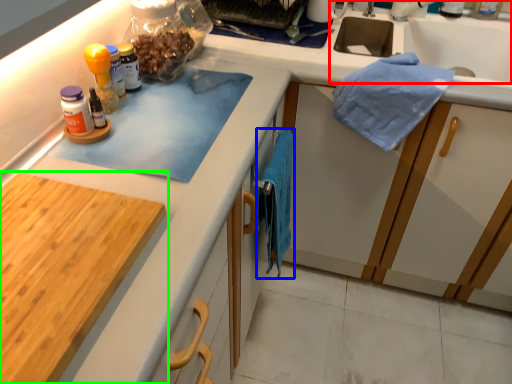
Question: Which object is the closest to the sink (highlighted by a red box)? Choose among these: bath towel (highlighted by a blue box) or cabinetry (highlighted by a green box).

Choices:
 (A) bath towel
 (B) cabinetry

Answer: (A)